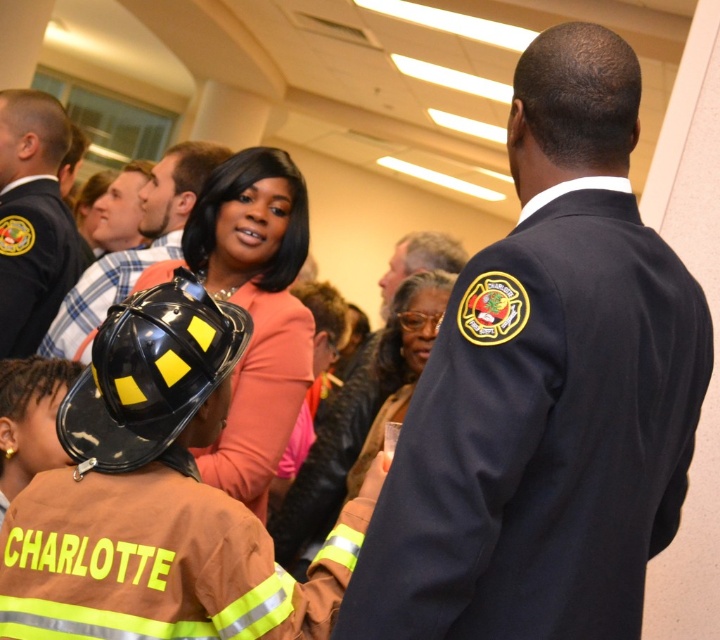
Which of these two, black matte helmet at lower left or dark brown leather jacket at center, stands taller?

Standing taller between the two is dark brown leather jacket at center.

You are a GUI agent. You are given a task and a screenshot of the screen. Output one action in this format:
    pyautogui.click(x=<x>, y=<y>)
    Task: Click on the black matte helmet at lower left
    Image resolution: width=720 pixels, height=640 pixels.
    Given the screenshot: What is the action you would take?
    pyautogui.click(x=148, y=372)

Where is `black matte helmet at lower left`? black matte helmet at lower left is located at coordinates (148, 372).

Is the position of navy blue uniform at center less distant than that of matte black helmet at center?

Yes, navy blue uniform at center is in front of matte black helmet at center.

Consider the image. Can you confirm if navy blue uniform at center is taller than matte black helmet at center?

In fact, navy blue uniform at center may be shorter than matte black helmet at center.

Is point (621, 328) in front of point (266, 385)?

Yes.

At what (x,y) coordinates should I click in order to perform the action: click on navy blue uniform at center. Please return your answer as a coordinate pair (x, y). The image size is (720, 640). Looking at the image, I should click on (546, 390).

Is black matte helmet at center positioned before dark brown leather jacket at center?

Yes, black matte helmet at center is closer to the viewer.

Which is below, black matte helmet at center or dark brown leather jacket at center?

dark brown leather jacket at center is lower down.

Identify the location of black matte helmet at center. (135, 248).

Locate an element on the screen. This screenshot has width=720, height=640. black matte helmet at center is located at coordinates (135, 248).